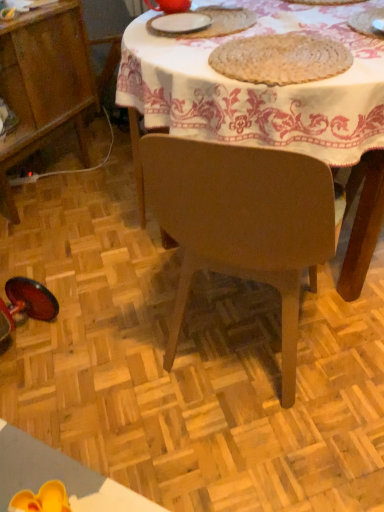
This screenshot has height=512, width=384. Identify the location of free space between white matte plate at upper center, the 2th tableware in the left-to-right sequence, and matte red teapot at upper center, arranged as the 1th tableware when viewed from the left. (185, 21).